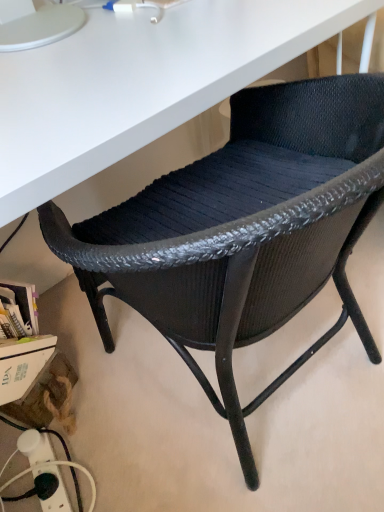
The width and height of the screenshot is (384, 512). What are the coordinates of `unoccupied space behind black plastic power strip at lower left` in the screenshot? It's located at (71, 419).